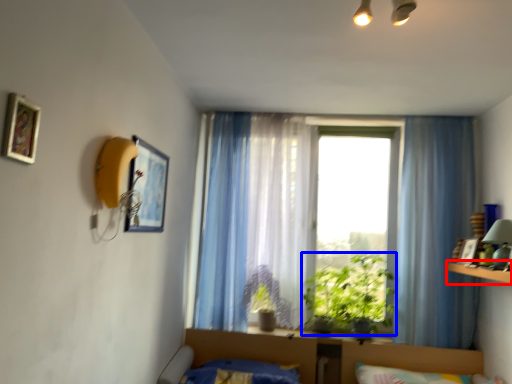
Question: Which object appears closest to the camera in this image, ledge (highlighted by a red box) or vegetation (highlighted by a blue box)?

Choices:
 (A) ledge
 (B) vegetation

Answer: (A)